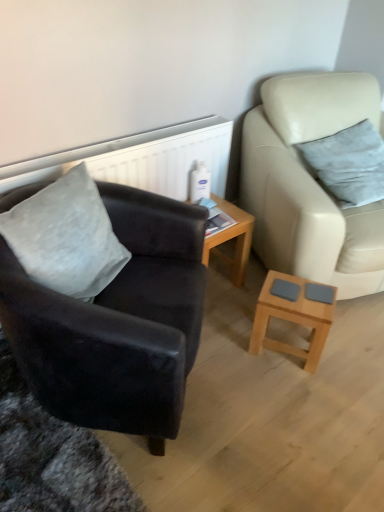
Identify the location of velvety gray pillow at right, the first pillow viewed from the back. The height and width of the screenshot is (512, 384). (348, 164).

The width and height of the screenshot is (384, 512). What do you see at coordinates (294, 314) in the screenshot?
I see `light brown wooden coffee table at lower right` at bounding box center [294, 314].

You are a GUI agent. You are given a task and a screenshot of the screen. Output one action in this format:
    pyautogui.click(x=<x>, y=<y>)
    Task: Click on the suede black armchair at left
    
    Given the screenshot: What is the action you would take?
    pyautogui.click(x=117, y=323)

This screenshot has width=384, height=512. Describe the element at coordinates (231, 239) in the screenshot. I see `wooden table at center` at that location.

What is the approximate width of wooden table at center?

12.79 inches.

The height and width of the screenshot is (512, 384). What are the coordinates of `velvety gray pillow at right, which is the second pillow in left-to-right order` in the screenshot? It's located at point(348,164).

From the image's perspective, is gray velvety pillow at left, arranged as the 2th pillow when viewed from the right, above or below leather studio couch at right?

Based on their image positions, gray velvety pillow at left, arranged as the 2th pillow when viewed from the right, is located beneath leather studio couch at right.

Is gray velvety pillow at left, the first pillow viewed from the left, not within leather studio couch at right?

Yes, gray velvety pillow at left, the first pillow viewed from the left, is outside of leather studio couch at right.

Looking at this image, is gray velvety pillow at left, the second pillow when ordered from back to front, to the left or to the right of leather studio couch at right in the image?

In the image, gray velvety pillow at left, the second pillow when ordered from back to front, appears on the left side of leather studio couch at right.

In the image, there is a gray velvety pillow at left, the first pillow viewed from the left. What are the coordinates of `studio couch below it (from a real-world perspective)` in the screenshot? It's located at (310, 182).

Between suede black armchair at left and velvety gray pillow at right, positioned as the 1th pillow in right-to-left order, which one has more height?

suede black armchair at left is taller.

Are suede black armchair at left and velvety gray pillow at right, positioned as the 1th pillow in right-to-left order, beside each other?

No, suede black armchair at left is not with velvety gray pillow at right, positioned as the 1th pillow in right-to-left order.

From a real-world perspective, is suede black armchair at left physically below velvety gray pillow at right, positioned as the 1th pillow in right-to-left order?

Yes, from a real-world perspective, suede black armchair at left is under velvety gray pillow at right, positioned as the 1th pillow in right-to-left order.

Can you see suede black armchair at left touching gray velvety pillow at left, arranged as the 1th pillow when viewed from the front?

No, suede black armchair at left is not with gray velvety pillow at left, arranged as the 1th pillow when viewed from the front.

Considering the sizes of suede black armchair at left and gray velvety pillow at left, the second pillow when ordered from back to front, in the image, is suede black armchair at left bigger or smaller than gray velvety pillow at left, the second pillow when ordered from back to front,?

Clearly, suede black armchair at left is larger in size than gray velvety pillow at left, the second pillow when ordered from back to front.

Who is taller, suede black armchair at left or gray velvety pillow at left, arranged as the 2th pillow when viewed from the right?

Standing taller between the two is suede black armchair at left.

Which object is closer to the camera taking this photo, leather studio couch at right or gray velvety pillow at left, the second pillow when ordered from back to front?

gray velvety pillow at left, the second pillow when ordered from back to front.

Is leather studio couch at right beside gray velvety pillow at left, the second pillow when ordered from back to front?

No, leather studio couch at right is not touching gray velvety pillow at left, the second pillow when ordered from back to front.

Is leather studio couch at right surrounding gray velvety pillow at left, arranged as the 2th pillow when viewed from the right?

No, gray velvety pillow at left, arranged as the 2th pillow when viewed from the right, is not a part of leather studio couch at right.

Could you tell me if velvety gray pillow at right, the first pillow viewed from the back, is facing gray velvety pillow at left, arranged as the 2th pillow when viewed from the right?

No, velvety gray pillow at right, the first pillow viewed from the back, is not aimed at gray velvety pillow at left, arranged as the 2th pillow when viewed from the right.

Is point (340, 169) closer to camera compared to point (52, 246)?

No, it is not.

From the image's perspective, is velvety gray pillow at right, the 2th pillow from the front, under gray velvety pillow at left, arranged as the 1th pillow when viewed from the front?

No.

At what (x,y) coordinates should I click in order to perform the action: click on pillow on the right of gray velvety pillow at left, arranged as the 1th pillow when viewed from the front. Please return your answer as a coordinate pair (x, y). The image size is (384, 512). Looking at the image, I should click on (348, 164).

Is light brown wooden coffee table at lower right next to suede black armchair at left?

No, light brown wooden coffee table at lower right is not in contact with suede black armchair at left.

From a real-world perspective, is light brown wooden coffee table at lower right physically located above or below suede black armchair at left?

From a real-world perspective, light brown wooden coffee table at lower right is physically below suede black armchair at left.

From the image's perspective, which one is positioned higher, light brown wooden coffee table at lower right or suede black armchair at left?

From the image's view, suede black armchair at left is above.

Considering the positions of objects light brown wooden coffee table at lower right and suede black armchair at left in the image provided, who is more to the right, light brown wooden coffee table at lower right or suede black armchair at left?

light brown wooden coffee table at lower right.

Is gray velvety pillow at left, the second pillow when ordered from back to front, oriented away from velvety gray pillow at right, the first pillow viewed from the back?

That's not correct — gray velvety pillow at left, the second pillow when ordered from back to front, is not looking away from velvety gray pillow at right, the first pillow viewed from the back.

Find the location of a particular element. This screenshot has width=384, height=512. pillow directly beneath the gray velvety pillow at left, the second pillow when ordered from back to front (from a real-world perspective) is located at coordinates (348, 164).

Is gray velvety pillow at left, the second pillow when ordered from back to front, bigger than velvety gray pillow at right, the 2th pillow from the front?

Actually, gray velvety pillow at left, the second pillow when ordered from back to front, might be smaller than velvety gray pillow at right, the 2th pillow from the front.

Which is farther, (104,207) or (303,151)?

Point (303,151)

The image size is (384, 512). Find the location of `pillow below the leather studio couch at right (from the image's perspective)`. pillow below the leather studio couch at right (from the image's perspective) is located at coordinates (66, 237).

This screenshot has width=384, height=512. Identify the location of the 2nd pillow behind the suede black armchair at left, starting your count from the anchor. (348, 164).

From the image, which object appears to be farther from wooden table at center, leather studio couch at right or light brown wooden coffee table at lower right?

light brown wooden coffee table at lower right is positioned further to the anchor wooden table at center.

When comparing their distances from leather studio couch at right, does light brown wooden coffee table at lower right or velvety gray pillow at right, the first pillow viewed from the back, seem further?

light brown wooden coffee table at lower right lies further to leather studio couch at right than the other object.

From the image, which object appears to be nearer to suede black armchair at left, gray velvety pillow at left, the first pillow viewed from the left, or velvety gray pillow at right, the 2th pillow from the front?

gray velvety pillow at left, the first pillow viewed from the left, is closer to suede black armchair at left.

Estimate the real-world distances between objects in this image. Which object is further from suede black armchair at left, light brown wooden coffee table at lower right or gray velvety pillow at left, arranged as the 1th pillow when viewed from the front?

Among the two, light brown wooden coffee table at lower right is located further to suede black armchair at left.

Considering their positions, is velvety gray pillow at right, which is the second pillow in left-to-right order, positioned closer to leather studio couch at right than gray velvety pillow at left, arranged as the 2th pillow when viewed from the right?

velvety gray pillow at right, which is the second pillow in left-to-right order, lies closer to leather studio couch at right than the other object.

Which object lies further to the anchor point wooden table at center, suede black armchair at left or leather studio couch at right?

suede black armchair at left is positioned further to the anchor wooden table at center.

Which object lies further to the anchor point light brown wooden coffee table at lower right, leather studio couch at right or gray velvety pillow at left, the second pillow when ordered from back to front?

gray velvety pillow at left, the second pillow when ordered from back to front, is positioned further to the anchor light brown wooden coffee table at lower right.

When comparing their distances from wooden table at center, does velvety gray pillow at right, the first pillow viewed from the back, or suede black armchair at left seem further?

velvety gray pillow at right, the first pillow viewed from the back, is further to wooden table at center.

Locate an element on the screen. This screenshot has height=512, width=384. studio couch between velvety gray pillow at right, positioned as the 1th pillow in right-to-left order, and light brown wooden coffee table at lower right, in the vertical direction is located at coordinates [x=310, y=182].

Find the location of a particular element. This screenshot has height=512, width=384. chair between gray velvety pillow at left, the first pillow viewed from the left, and light brown wooden coffee table at lower right is located at coordinates (117, 323).

The width and height of the screenshot is (384, 512). In order to click on chair between gray velvety pillow at left, the first pillow viewed from the left, and velvety gray pillow at right, which is the second pillow in left-to-right order, in the horizontal direction in this screenshot , I will do `click(117, 323)`.

Image resolution: width=384 pixels, height=512 pixels. What are the coordinates of `coffee table between suede black armchair at left and velvety gray pillow at right, the first pillow viewed from the back, from left to right` in the screenshot? It's located at (294, 314).